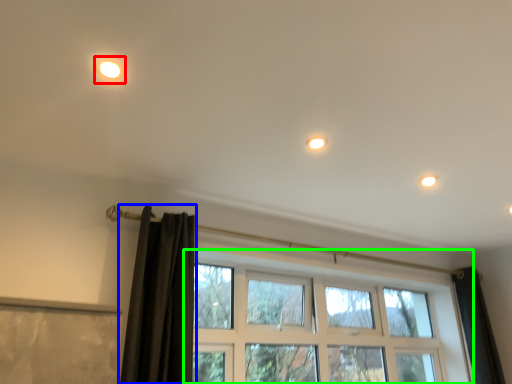
Question: Which is nearer to the light (highlighted by a red box)? curtain (highlighted by a blue box) or window (highlighted by a green box).

Choices:
 (A) curtain
 (B) window

Answer: (A)